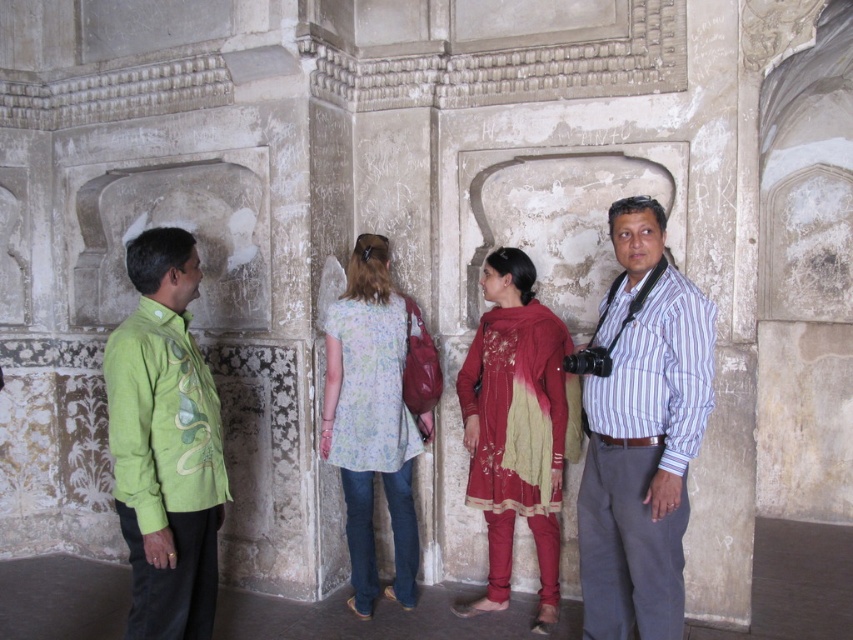
Question: Which object is the farthest from the floral-patterned fabric dress at center?

Choices:
 (A) maroon satin salwar kameez at center
 (B) green embroidered shirt at left

Answer: (B)

Question: Does striped cotton shirt at center have a smaller size compared to floral-patterned fabric dress at center?

Choices:
 (A) yes
 (B) no

Answer: (A)

Question: Which point is farther from the camera taking this photo?

Choices:
 (A) (136, 260)
 (B) (397, 500)
 (C) (556, 580)
 (D) (592, 449)

Answer: (B)

Question: Which is farther from the green embroidered shirt at left?

Choices:
 (A) maroon satin salwar kameez at center
 (B) floral-patterned fabric dress at center

Answer: (A)

Question: Is striped cotton shirt at center bigger than maroon satin salwar kameez at center?

Choices:
 (A) yes
 (B) no

Answer: (B)

Question: In this image, where is striped cotton shirt at center located relative to floral-patterned fabric dress at center?

Choices:
 (A) below
 (B) above

Answer: (B)